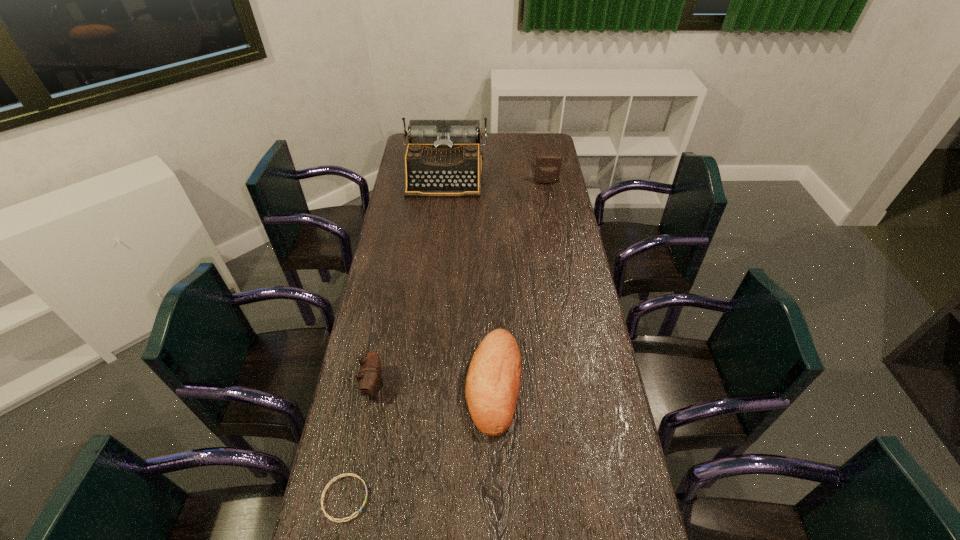
The image size is (960, 540). In order to click on empty space that is in between the bread and the typewriter in this screenshot , I will do (x=469, y=279).

The image size is (960, 540). I want to click on vacant region between the rightmost object and the nearest object, so click(445, 340).

Locate which object ranks in proximity to the rightmost object. Please provide its 2D coordinates. Your answer should be formatted as a tuple, i.e. [(x, y)], where the tuple contains the x and y coordinates of a point satisfying the conditions above.

[(443, 158)]

The height and width of the screenshot is (540, 960). What are the coordinates of `object that stands as the fourth closest to the fourth tallest object` in the screenshot? It's located at (548, 166).

You are a GUI agent. You are given a task and a screenshot of the screen. Output one action in this format:
    pyautogui.click(x=<x>, y=<y>)
    Task: Click on the free point that satisfies the following two spatial constraints: 1. with an open flap on the fourth shortest object; 2. on the surface of the nearest object showing star-shaped elements
    
    Given the screenshot: What is the action you would take?
    pyautogui.click(x=605, y=498)

Find the location of `vacant space that satisfies the following two spatial constraints: 1. on the front side of the second shortest object; 2. on the surface of the shortest object showing star-shaped elements`. vacant space that satisfies the following two spatial constraints: 1. on the front side of the second shortest object; 2. on the surface of the shortest object showing star-shaped elements is located at coordinates (496, 498).

Locate an element on the screen. The height and width of the screenshot is (540, 960). free spot that satisfies the following two spatial constraints: 1. on the keyboard of the tallest object; 2. on the surface of the bracelet showing star-shaped elements is located at coordinates (413, 498).

Locate an element on the screen. The height and width of the screenshot is (540, 960). free spot that satisfies the following two spatial constraints: 1. on the keyboard of the tallest object; 2. with the flap open on the nearer pouch is located at coordinates (424, 386).

At what (x,y) coordinates should I click in order to perform the action: click on vacant position in the image that satisfies the following two spatial constraints: 1. with an open flap on the taller pouch; 2. on the surface of the shortest object showing star-shaped elements. Please return your answer as a coordinate pair (x, y). Image resolution: width=960 pixels, height=540 pixels. Looking at the image, I should click on (605, 498).

Locate an element on the screen. This screenshot has height=540, width=960. free point that satisfies the following two spatial constraints: 1. on the keyboard of the tallest object; 2. on the surface of the nearest object showing star-shaped elements is located at coordinates (413, 498).